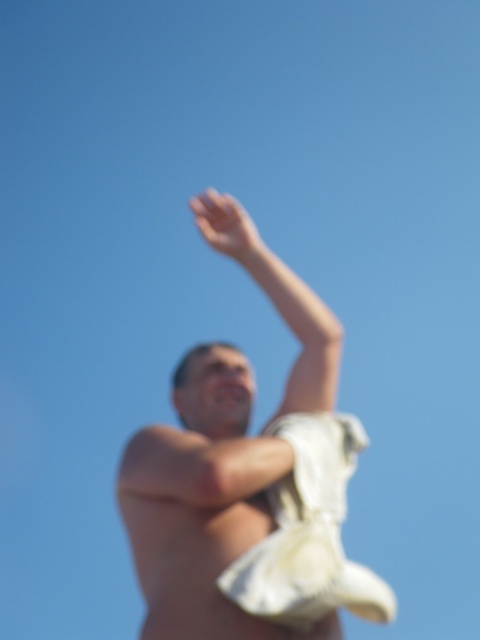
Who is positioned more to the right, white cloth at upper center or smooth white arm at upper center?

From the viewer's perspective, white cloth at upper center appears more on the right side.

Locate an element on the screen. This screenshot has height=640, width=480. white cloth at upper center is located at coordinates (249, 477).